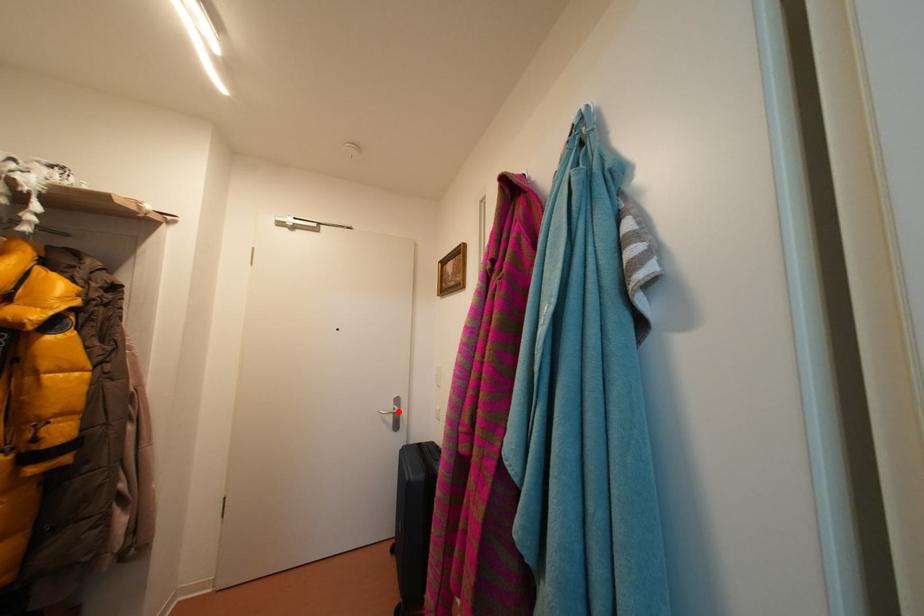
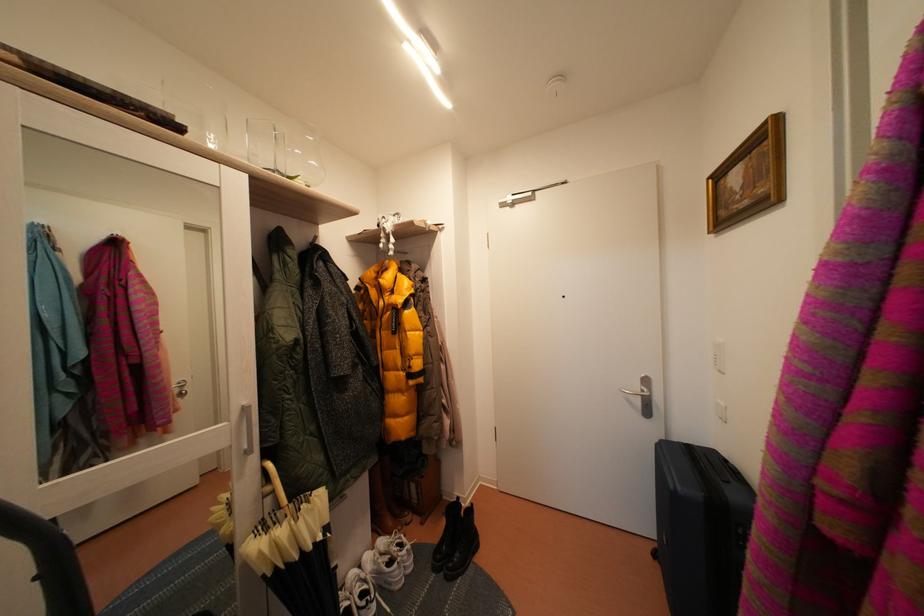
The point at the highlighted location is marked in the first image. Where is the corresponding point in the second image?

(645, 392)